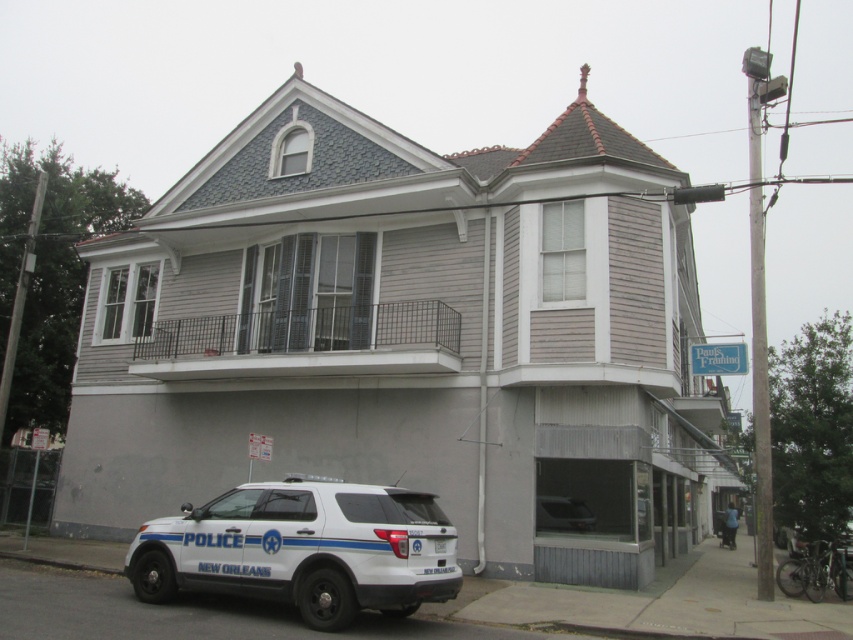
Does white matte police car at lower left appear on the left side of metallic gray sedan at lower center?

Correct, you'll find white matte police car at lower left to the left of metallic gray sedan at lower center.

Who is lower down, white matte police car at lower left or metallic gray sedan at lower center?

Positioned lower is metallic gray sedan at lower center.

Which is behind, point (183, 506) or point (537, 508)?

The point (183, 506) is more distant.

Locate an element on the screen. white matte police car at lower left is located at coordinates (305, 548).

Identify the location of metallic gray sedan at lower center. The width and height of the screenshot is (853, 640). tap(563, 515).

The height and width of the screenshot is (640, 853). I want to click on metallic gray sedan at lower center, so pos(563,515).

Which is behind, point (151, 518) or point (730, 520)?

The point (730, 520) is behind.

Which is below, white matte police car at lower left or blue metallic police car at lower right?

blue metallic police car at lower right is below.

This screenshot has height=640, width=853. What do you see at coordinates (305, 548) in the screenshot? I see `white matte police car at lower left` at bounding box center [305, 548].

Image resolution: width=853 pixels, height=640 pixels. In order to click on white matte police car at lower left in this screenshot , I will do `click(305, 548)`.